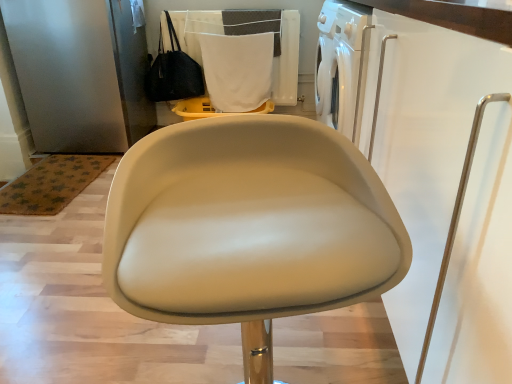
Question: Is black leather handbag at upper left positioned before beige leather chair at center?

Choices:
 (A) yes
 (B) no

Answer: (B)

Question: From a real-world perspective, is black leather handbag at upper left under beige leather chair at center?

Choices:
 (A) no
 (B) yes

Answer: (A)

Question: Does black leather handbag at upper left have a greater width compared to beige leather chair at center?

Choices:
 (A) no
 (B) yes

Answer: (A)

Question: Is black leather handbag at upper left far from beige leather chair at center?

Choices:
 (A) no
 (B) yes

Answer: (B)

Question: Is black leather handbag at upper left thinner than beige leather chair at center?

Choices:
 (A) no
 (B) yes

Answer: (B)

Question: Is black leather handbag at upper left situated inside white fabric at upper center or outside?

Choices:
 (A) outside
 (B) inside

Answer: (A)

Question: From the image's perspective, is black leather handbag at upper left above or below white fabric at upper center?

Choices:
 (A) below
 (B) above

Answer: (B)

Question: Would you say black leather handbag at upper left is to the left or to the right of white fabric at upper center in the picture?

Choices:
 (A) left
 (B) right

Answer: (A)

Question: From their relative heights in the image, would you say black leather handbag at upper left is taller or shorter than white fabric at upper center?

Choices:
 (A) short
 (B) tall

Answer: (A)

Question: In terms of size, does white fabric laundry at upper center appear bigger or smaller than white fabric at upper center?

Choices:
 (A) small
 (B) big

Answer: (B)

Question: From a real-world perspective, relative to white fabric at upper center, is white fabric laundry at upper center vertically above or below?

Choices:
 (A) below
 (B) above

Answer: (B)

Question: From the image's perspective, is white fabric laundry at upper center located above or below white fabric at upper center?

Choices:
 (A) below
 (B) above

Answer: (B)

Question: In the image, is white fabric laundry at upper center on the left side or the right side of white fabric at upper center?

Choices:
 (A) right
 (B) left

Answer: (B)

Question: Considering their positions, is beige leather chair at center located in front of or behind black leather handbag at upper left?

Choices:
 (A) behind
 (B) front

Answer: (B)

Question: Do you think beige leather chair at center is within black leather handbag at upper left, or outside of it?

Choices:
 (A) inside
 (B) outside

Answer: (B)